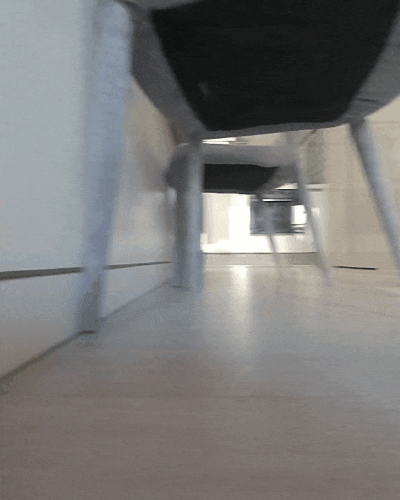
I want to click on floor, so click(153, 438), click(309, 367).